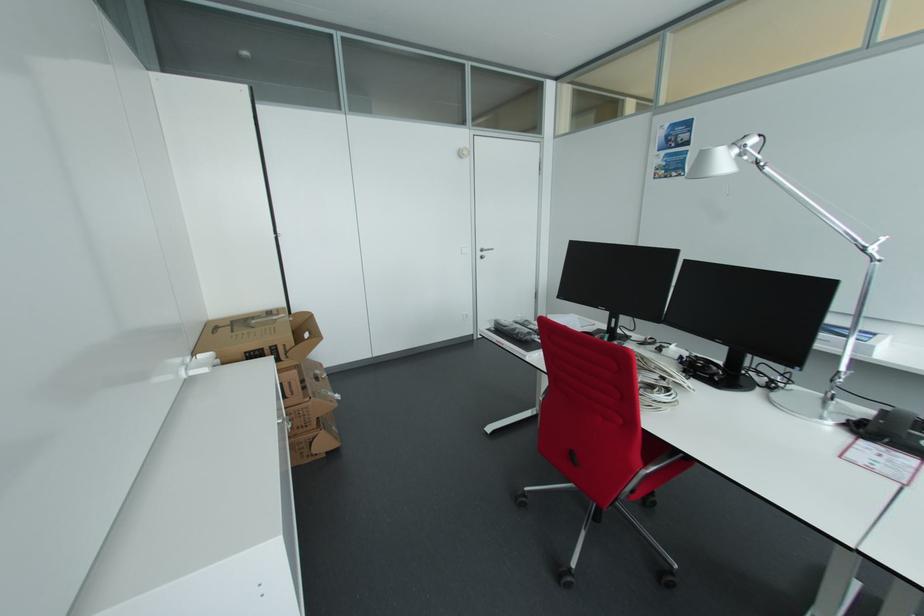
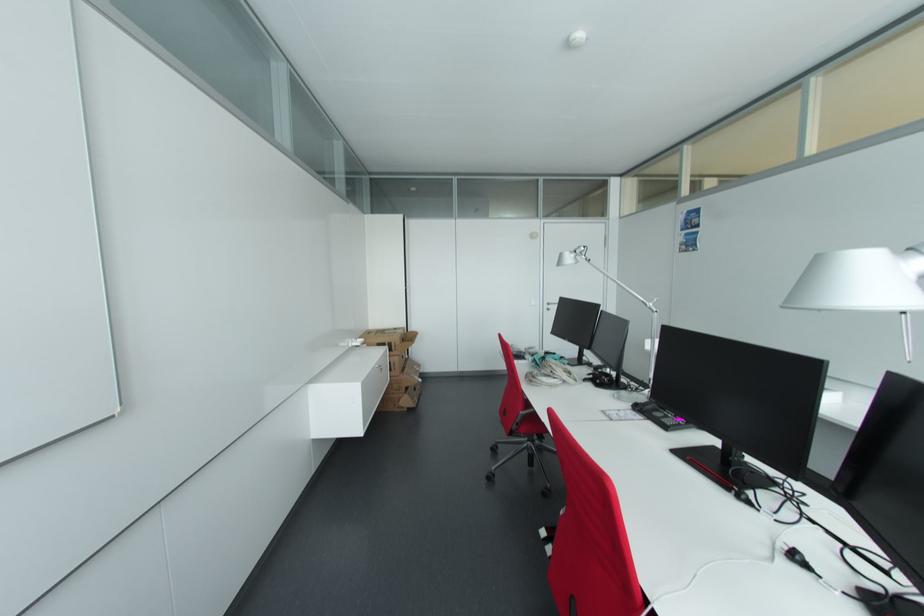
The images are taken continuously from a first-person perspective. In which direction are you moving?

The movement direction of the cameraman is right, backward.